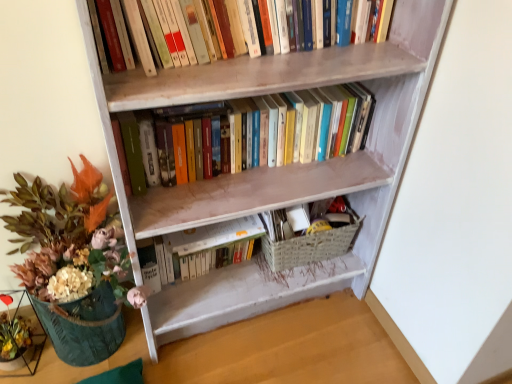
Question: Based on their sizes in the image, would you say wooden bookcase at center is bigger or smaller than green textured vase at lower left?

Choices:
 (A) small
 (B) big

Answer: (B)

Question: From a real-world perspective, is wooden bookcase at center above or below green textured vase at lower left?

Choices:
 (A) below
 (B) above

Answer: (B)

Question: Based on their relative distances, which object is nearer to the wooden bookcase at center?

Choices:
 (A) hardcover books at center, which is the 2th book in bottom-to-top order
 (B) hardcover books at upper center, marked as the 1th book in a top-to-bottom arrangement
 (C) woven beige basket at lower center
 (D) white matte book at center, which appears as the 1th book when ordered from the bottom
 (E) green textured vase at lower left

Answer: (A)

Question: Which object is positioned closest to the white matte book at center, which appears as the 1th book when ordered from the bottom?

Choices:
 (A) green textured vase at lower left
 (B) woven beige basket at lower center
 (C) hardcover books at center, the second book when ordered from top to bottom
 (D) wooden bookcase at center
 (E) hardcover books at upper center, marked as the 1th book in a top-to-bottom arrangement

Answer: (B)